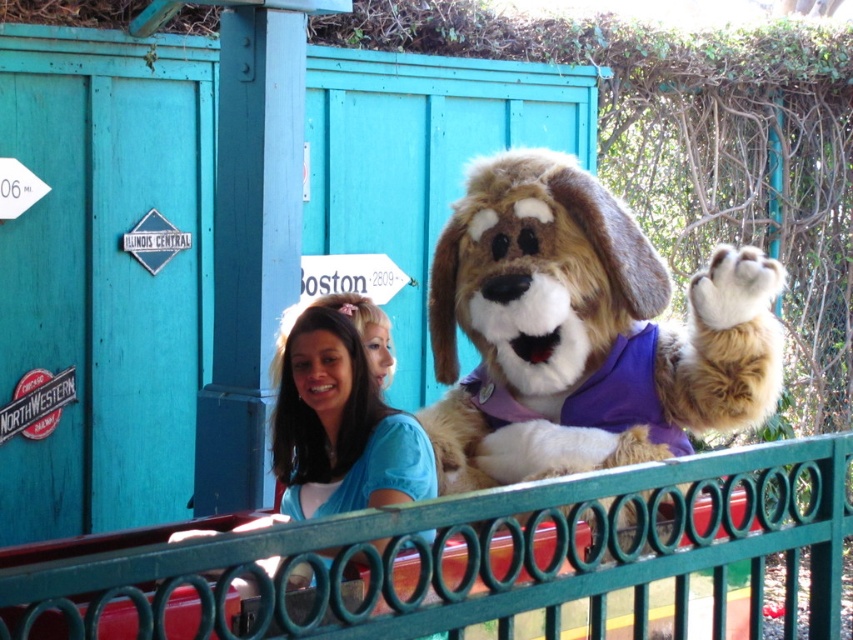
You are standing at the center of the image and want to walk towards the green metal fence at center. Which direction should you go?

Since the green metal fence at center is located at point [492,554] in 2D coordinates, you should move towards the right and slightly downward to reach it.

You are a photographer trying to capture a photo of the fluffy brown dog at center without including the green metal fence at center in the frame. Based on their positions, is this possible?

The green metal fence at center is positioned on the left side of the fluffy brown dog at center, so if you move to the right side of the dog, you can avoid including the fence in the photo.